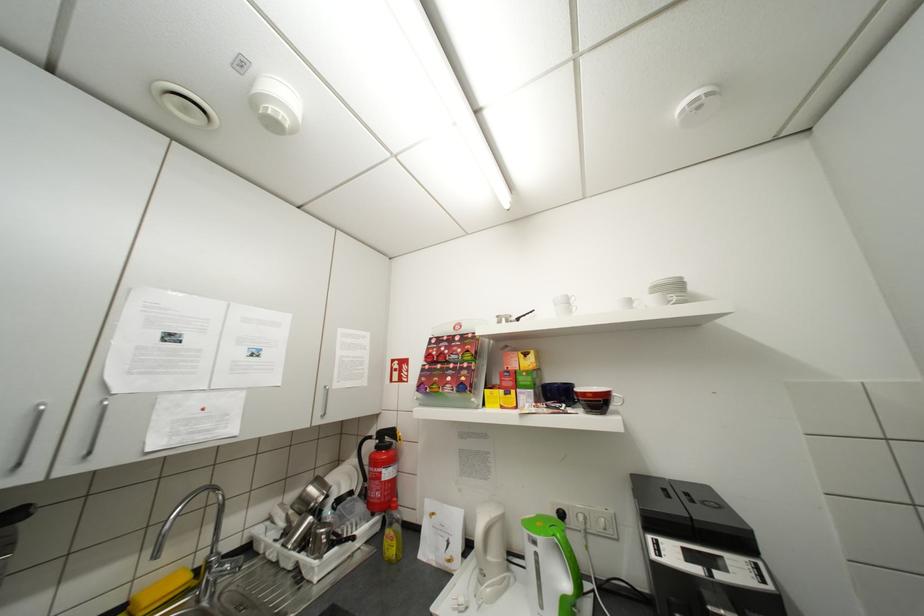
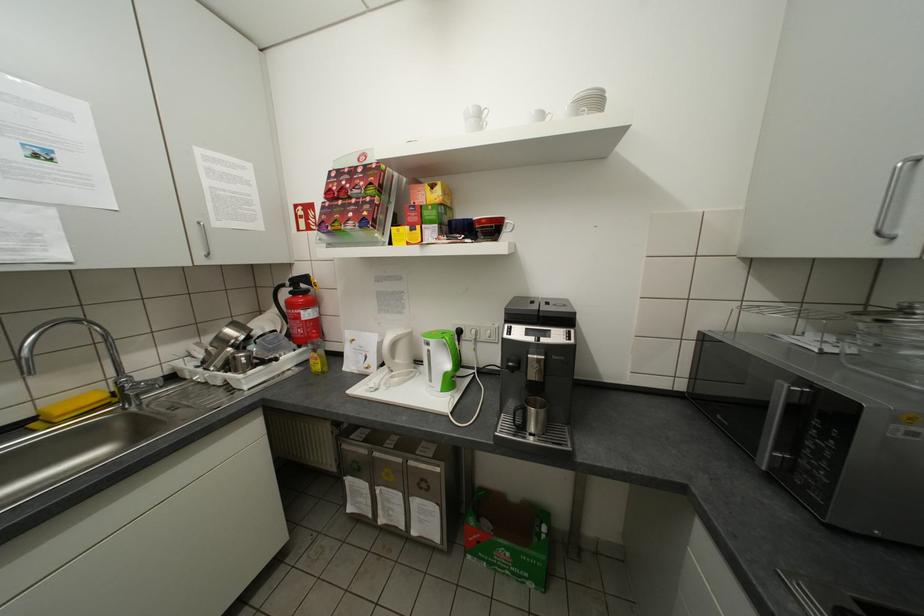
Locate, in the second image, the point that corresponds to the point at 394,543 in the first image.

(321, 362)